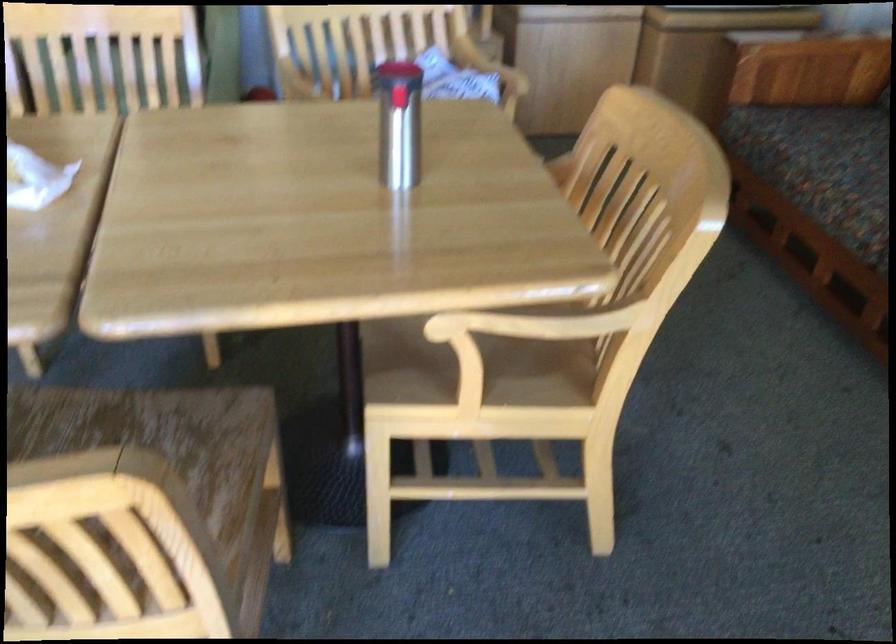
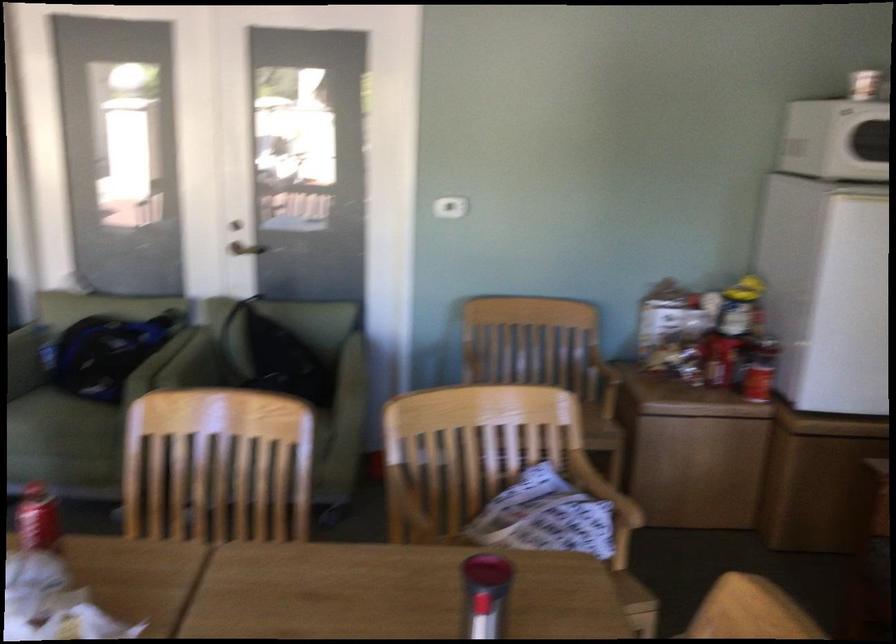
The images are taken continuously from a first-person perspective. In which direction are you moving?

The cameraman walked toward right, forward.